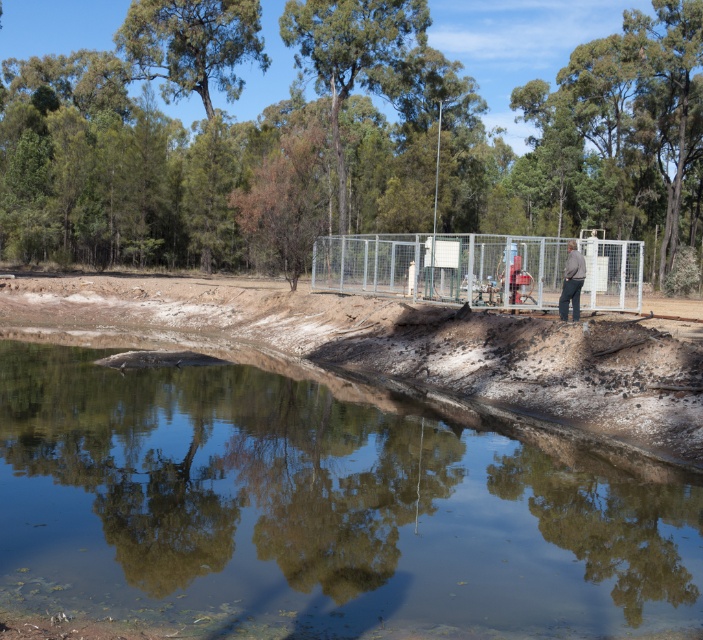
You are standing at the edge of the water in the serene outdoor scene. You see a metallic fence at center and a gray fabric jacket at center. Which object is higher up from the ground?

The metallic fence at center is above the gray fabric jacket at center, so the metallic fence at center is higher up from the ground.

You are a drone operator trying to locate a specific point in the image. The point you need to find is point (322, 509). Based on the scene description, where would this point be located?

The point (322, 509) is located on clear water at center.

Looking at this image, you are standing at the shore of the water body in the image. There are two points marked in the scene, point 1 at coordinates point (x=352, y=246) and point 2 at coordinates point (x=562, y=317). Which point is closer to you?

Point (x=352, y=246) is further to the camera than point (x=562, y=317), so the closer point to you is point (x=562, y=317).